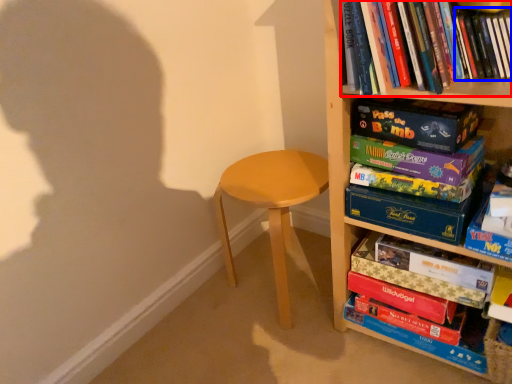
Question: Which of the following is the closest to the observer, book (highlighted by a red box) or book (highlighted by a blue box)?

Choices:
 (A) book
 (B) book

Answer: (A)